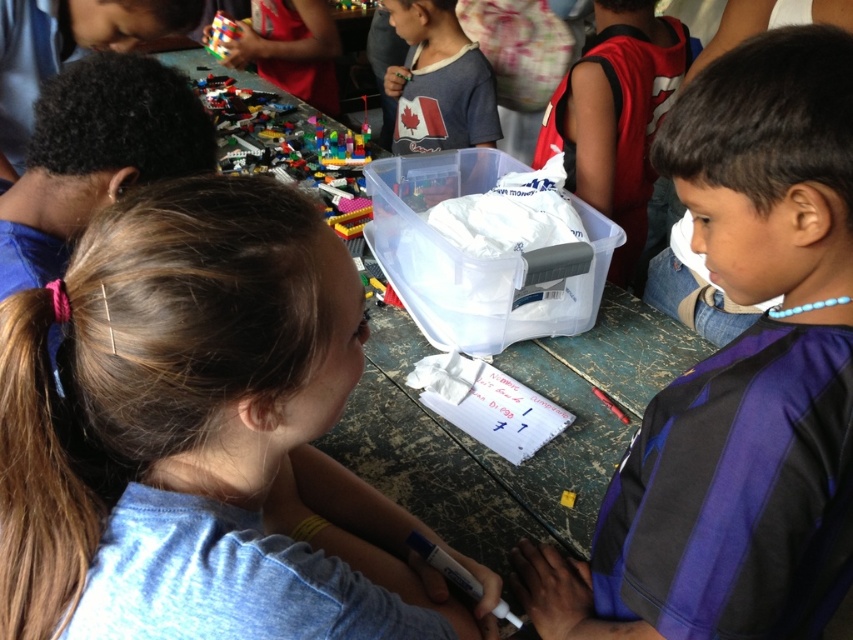
Can you confirm if smooth blue shirt at center is smaller than rubik's cube at upper left?

No.

Measure the distance between smooth blue shirt at center and camera.

smooth blue shirt at center is 18.54 inches away from camera.

What do you see at coordinates (175, 380) in the screenshot?
I see `smooth blue shirt at center` at bounding box center [175, 380].

Find the location of `smooth blue shirt at center`. smooth blue shirt at center is located at coordinates [175, 380].

Which is behind, point (592, 620) or point (221, 58)?

Point (221, 58)

Does purple fabric shirt at center appear on the left side of rubik's cube at upper left?

Incorrect, purple fabric shirt at center is not on the left side of rubik's cube at upper left.

Between point (821, 461) and point (218, 48), which one is positioned behind?

Point (218, 48)

Identify the location of purple fabric shirt at center. (738, 378).

Does purple fabric shirt at center appear on the right side of matte white shirt at center?

No, purple fabric shirt at center is not to the right of matte white shirt at center.

Is point (786, 278) in front of point (590, 54)?

Yes, point (786, 278) is in front of point (590, 54).

Locate an element on the screen. The height and width of the screenshot is (640, 853). purple fabric shirt at center is located at coordinates (738, 378).

Where is `purple fabric shirt at center`? purple fabric shirt at center is located at coordinates (738, 378).